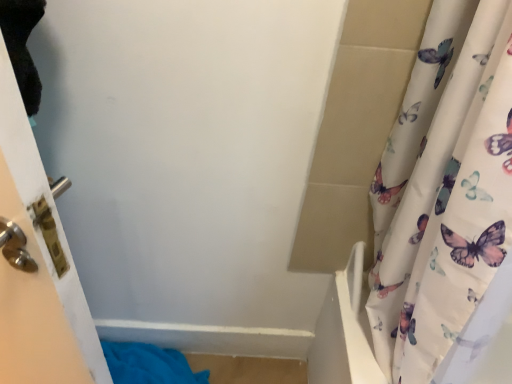
The width and height of the screenshot is (512, 384). I want to click on white glossy door at left, so click(x=36, y=231).

Measure the distance between point (52, 354) and camera.

The depth of point (52, 354) is 32.68 inches.

What do you see at coordinates (36, 231) in the screenshot? The height and width of the screenshot is (384, 512). I see `white glossy door at left` at bounding box center [36, 231].

What is the approximate height of white glossy door at left?

20.74 inches.

What do you see at coordinates (149, 364) in the screenshot?
I see `blue fabric towel at lower left` at bounding box center [149, 364].

The width and height of the screenshot is (512, 384). What are the coordinates of `blue fabric towel at lower left` in the screenshot? It's located at (149, 364).

The width and height of the screenshot is (512, 384). I want to click on white glossy door at left, so click(x=36, y=231).

Can you confirm if white glossy door at left is positioned to the right of blue fabric towel at lower left?

In fact, white glossy door at left is to the left of blue fabric towel at lower left.

Does white glossy door at left lie behind blue fabric towel at lower left?

No, it is not.

Which point is more forward, (86, 326) or (164, 373)?

The point (86, 326) is more forward.

From the image's perspective, which is above, white glossy door at left or blue fabric towel at lower left?

From the image's view, white glossy door at left is above.

From a real-world perspective, is white glossy door at left physically located above or below blue fabric towel at lower left?

white glossy door at left is above blue fabric towel at lower left.

Is white glossy door at left wider than blue fabric towel at lower left?

Yes, white glossy door at left is wider than blue fabric towel at lower left.

Is white glossy door at left taller than blue fabric towel at lower left?

Correct, white glossy door at left is much taller as blue fabric towel at lower left.

Can you confirm if white glossy door at left is smaller than blue fabric towel at lower left?

No.

Is blue fabric towel at lower left completely or partially inside white glossy door at left?

No, white glossy door at left does not contain blue fabric towel at lower left.

Is white glossy door at left far away from blue fabric towel at lower left?

No, white glossy door at left is not far from blue fabric towel at lower left.

Is blue fabric towel at lower left at the back of white glossy door at left?

white glossy door at left does not have its back to blue fabric towel at lower left.

Can you tell me how much white glossy door at left and blue fabric towel at lower left differ in facing direction?

88.7 degrees separate the facing orientations of white glossy door at left and blue fabric towel at lower left.

Identify the location of door on the left side of blue fabric towel at lower left. The image size is (512, 384). (36, 231).

In the scene shown: Is blue fabric towel at lower left to the left or to the right of white glossy door at left in the image?

In the image, blue fabric towel at lower left appears on the right side of white glossy door at left.

Who is more distant, blue fabric towel at lower left or white glossy door at left?

Positioned behind is blue fabric towel at lower left.

Which is nearer, [159,376] or [45,346]?

Point [159,376] appears to be farther away from the viewer than point [45,346].

From the image's perspective, between blue fabric towel at lower left and white glossy door at left, who is located below?

blue fabric towel at lower left.

From a real-world perspective, which is physically above, blue fabric towel at lower left or white glossy door at left?

From a 3D spatial view, white glossy door at left is above.

Considering the relative sizes of blue fabric towel at lower left and white glossy door at left in the image provided, is blue fabric towel at lower left thinner than white glossy door at left?

Yes.

Considering the sizes of objects blue fabric towel at lower left and white glossy door at left in the image provided, who is shorter, blue fabric towel at lower left or white glossy door at left?

blue fabric towel at lower left.

Considering the sizes of blue fabric towel at lower left and white glossy door at left in the image, is blue fabric towel at lower left bigger or smaller than white glossy door at left?

Considering their sizes, blue fabric towel at lower left takes up less space than white glossy door at left.

Is blue fabric towel at lower left inside the boundaries of white glossy door at left, or outside?

blue fabric towel at lower left is not enclosed by white glossy door at left.

Is blue fabric towel at lower left in contact with white glossy door at left?

No, blue fabric towel at lower left is not in contact with white glossy door at left.

Is blue fabric towel at lower left facing towards white glossy door at left?

No, blue fabric towel at lower left does not turn towards white glossy door at left.

The width and height of the screenshot is (512, 384). What are the coordinates of `bath towel behind the white glossy door at left` in the screenshot? It's located at (149, 364).

Identify the location of bath towel behind the white glossy door at left. This screenshot has width=512, height=384. (149, 364).

The height and width of the screenshot is (384, 512). I want to click on door located on the left of blue fabric towel at lower left, so click(36, 231).